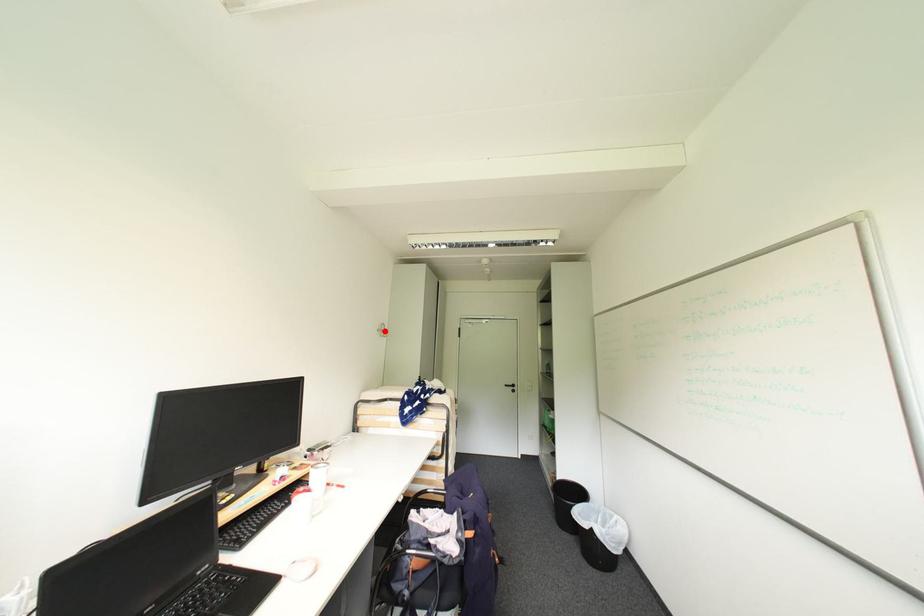
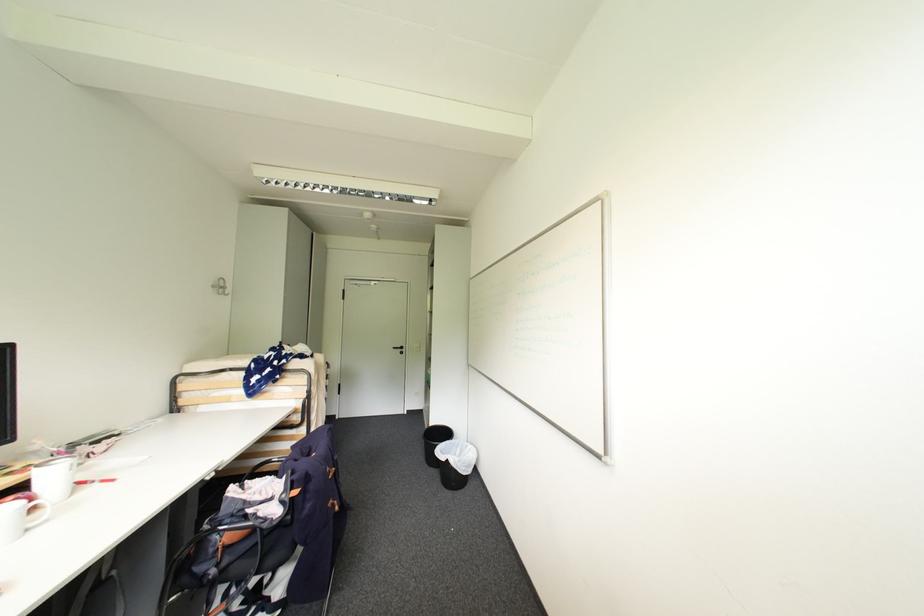
Locate, in the second image, the point that corresponds to the highlighted location in the first image.

(220, 286)